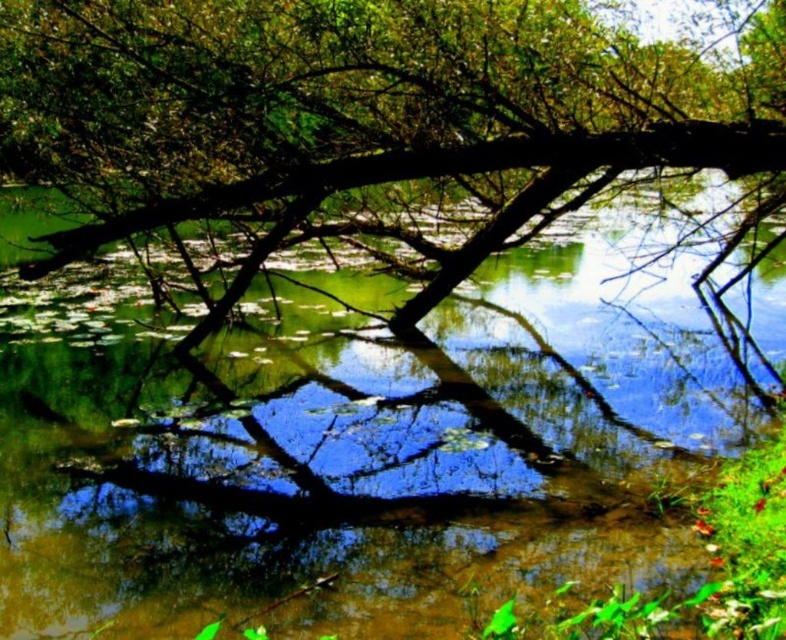
Is green reflective water at center further to the viewer compared to brown rough tree trunk at center?

Answer: No, it is not.

In the scene shown: Can you confirm if green reflective water at center is shorter than brown rough tree trunk at center?

Correct, green reflective water at center is not as tall as brown rough tree trunk at center.

Find the location of `green reflective water at center`. green reflective water at center is located at coordinates (355, 445).